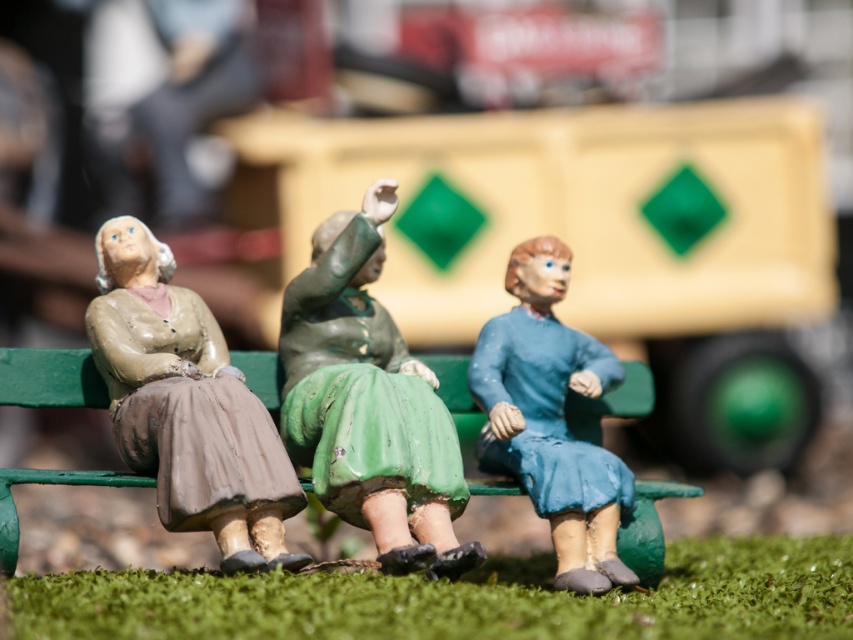
You are a toy collector who wants to place a new 10cm tall action figure between the green matte figure at center and the blue matte figure at center in the diorama. Will there be enough space for it?

The green matte figure at center is 8.08 inches from the blue matte figure at center. Since 8.08 inches is approximately 20.5 cm, there is enough space to place a 10cm tall action figure between them.

You are a small toy car that is 2 inches tall. You want to drive under the green painted wood park bench at center to reach the other side. Can you pass under it without hitting the green matte figure at center?

The green matte figure at center is located above the green painted wood park bench at center, so the space under the bench is clear. Since the toy car is only 2 inches tall, it can safely pass under the bench without hitting the figure.